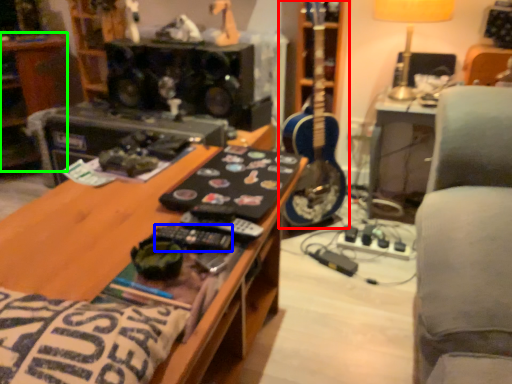
Question: Which is nearer to the guitar (highlighted by a red box)? control (highlighted by a blue box) or shelf (highlighted by a green box).

Choices:
 (A) control
 (B) shelf

Answer: (A)